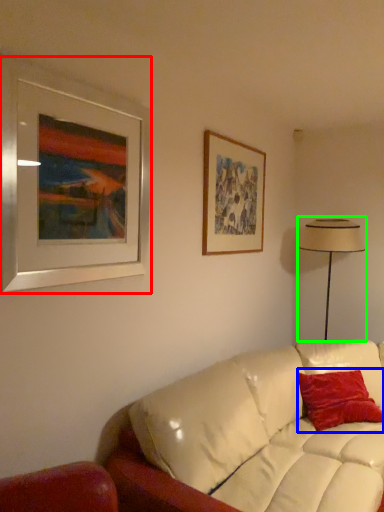
Question: Considering the real-world distances, which object is farthest from picture frame (highlighted by a red box)? pillow (highlighted by a blue box) or table lamp (highlighted by a green box)?

Choices:
 (A) pillow
 (B) table lamp

Answer: (B)